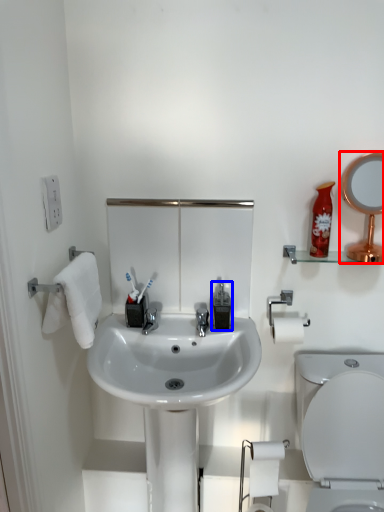
Question: Which of the following is the farthest to the observer, mirror (highlighted by a red box) or soap dispenser (highlighted by a blue box)?

Choices:
 (A) mirror
 (B) soap dispenser

Answer: (B)